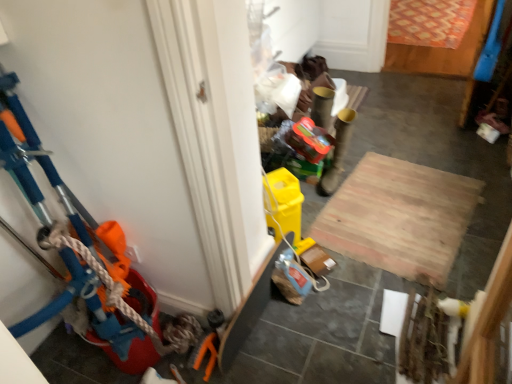
Question: Is wooden at center to the left or to the right of matte plastic bucket at left in the image?

Choices:
 (A) left
 (B) right

Answer: (B)

Question: In terms of size, does wooden at center appear bigger or smaller than matte plastic bucket at left?

Choices:
 (A) big
 (B) small

Answer: (B)

Question: In terms of width, does wooden at center look wider or thinner when compared to matte plastic bucket at left?

Choices:
 (A) thin
 (B) wide

Answer: (B)

Question: In terms of height, does matte plastic bucket at left look taller or shorter compared to wooden at center?

Choices:
 (A) short
 (B) tall

Answer: (B)

Question: From the image's perspective, is matte plastic bucket at left above or below wooden at center?

Choices:
 (A) below
 (B) above

Answer: (B)

Question: Relative to wooden at center, is matte plastic bucket at left in front or behind?

Choices:
 (A) front
 (B) behind

Answer: (A)

Question: Would you say matte plastic bucket at left is inside or outside wooden at center?

Choices:
 (A) inside
 (B) outside

Answer: (B)